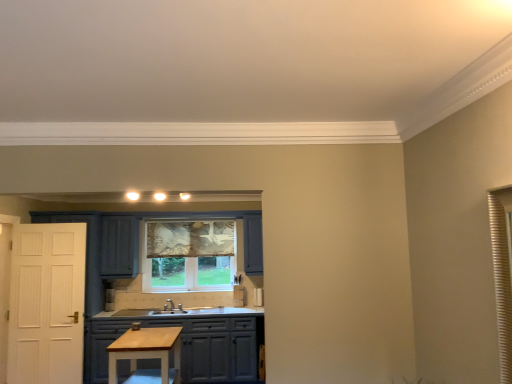
Question: Is matte gray cabinets at center touching light wood table at center?

Choices:
 (A) yes
 (B) no

Answer: (B)

Question: Is matte gray cabinets at center positioned before light wood table at center?

Choices:
 (A) no
 (B) yes

Answer: (A)

Question: Considering the relative sizes of matte gray cabinets at center and light wood table at center in the image provided, is matte gray cabinets at center shorter than light wood table at center?

Choices:
 (A) yes
 (B) no

Answer: (B)

Question: Considering the relative positions of matte gray cabinets at center and light wood table at center in the image provided, is matte gray cabinets at center to the right of light wood table at center from the viewer's perspective?

Choices:
 (A) no
 (B) yes

Answer: (B)

Question: From the image's perspective, is matte gray cabinets at center located beneath light wood table at center?

Choices:
 (A) yes
 (B) no

Answer: (A)

Question: Would you say matte gray cabinets at center is to the left or to the right of patterned fabric window at center in the picture?

Choices:
 (A) right
 (B) left

Answer: (B)

Question: Considering the positions of matte gray cabinets at center and patterned fabric window at center in the image, is matte gray cabinets at center wider or thinner than patterned fabric window at center?

Choices:
 (A) wide
 (B) thin

Answer: (A)

Question: In terms of height, does matte gray cabinets at center look taller or shorter compared to patterned fabric window at center?

Choices:
 (A) short
 (B) tall

Answer: (A)

Question: From a real-world perspective, is matte gray cabinets at center positioned above or below patterned fabric window at center?

Choices:
 (A) above
 (B) below

Answer: (B)

Question: Is point (189, 233) closer or farther from the camera than point (115, 377)?

Choices:
 (A) closer
 (B) farther

Answer: (B)

Question: Considering the positions of patterned fabric window at center and light wood table at center in the image, is patterned fabric window at center wider or thinner than light wood table at center?

Choices:
 (A) thin
 (B) wide

Answer: (A)

Question: In terms of size, does patterned fabric window at center appear bigger or smaller than light wood table at center?

Choices:
 (A) big
 (B) small

Answer: (B)

Question: Is patterned fabric window at center spatially inside light wood table at center, or outside of it?

Choices:
 (A) outside
 (B) inside

Answer: (A)

Question: In terms of size, does light wood table at center appear bigger or smaller than patterned fabric window at center?

Choices:
 (A) small
 (B) big

Answer: (B)

Question: Considering their positions, is light wood table at center located in front of or behind patterned fabric window at center?

Choices:
 (A) front
 (B) behind

Answer: (A)